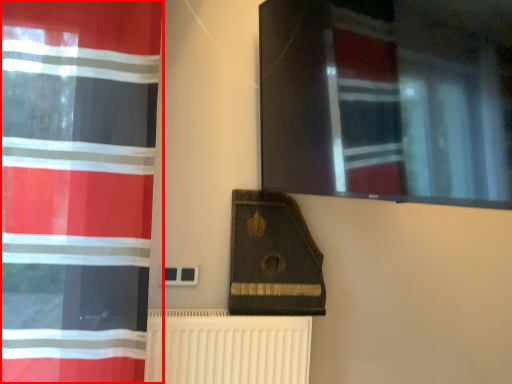
Question: From the image's perspective, considering the relative positions of curtain (annotated by the red box) and radiator in the image provided, where is curtain (annotated by the red box) located with respect to the staircase?

Choices:
 (A) above
 (B) below

Answer: (A)